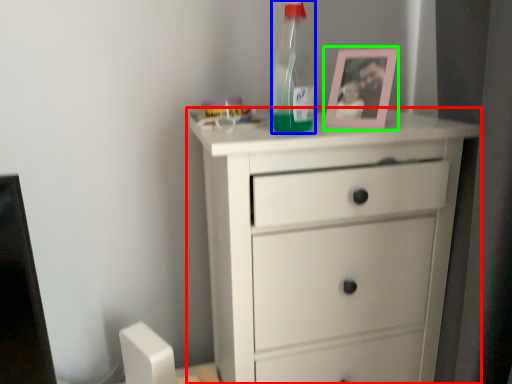
Question: Which object is positioned closest to chest of drawers (highlighted by a red box)? Select from bottle (highlighted by a blue box) and picture frame (highlighted by a green box).

Choices:
 (A) bottle
 (B) picture frame

Answer: (B)